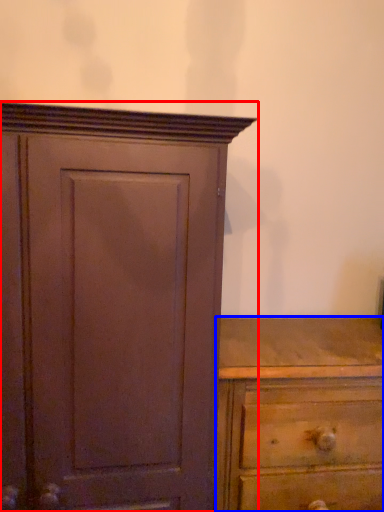
Question: Among these objects, which one is nearest to the camera, cupboard (highlighted by a red box) or chest of drawers (highlighted by a blue box)?

Choices:
 (A) cupboard
 (B) chest of drawers

Answer: (A)